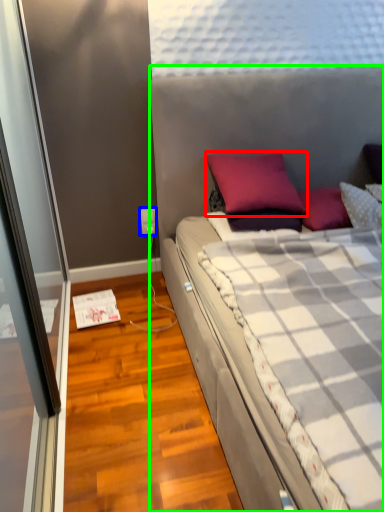
Question: Which is nearer to the pillow (highlighted by a red box)? power outlet (highlighted by a blue box) or bed (highlighted by a green box).

Choices:
 (A) power outlet
 (B) bed

Answer: (B)